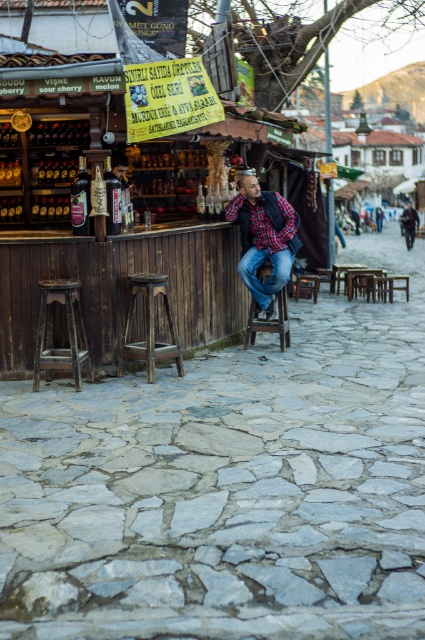
You are a customer at the bar and want to adjust your seating position to make more space for your bag. Which object should you move to create space between the wooden bar stool at center and the dark blue jeans at center?

You should move the wooden bar stool at center since it is positioned below the dark blue jeans at center, so moving it would create space between them.

You are a fashion designer observing a man in the scene. Which clothing item is located below the other between the plaid shirt at center and the dark blue jeans at center?

The plaid shirt at center is positioned under dark blue jeans at center, meaning the shirt is below the jeans.

You are a customer at the bar and want to order a drink. The bartender asks you to point to the sour cherry bottle on the counter. Which direction should you look relative to the plaid shirt at center and dark blue jeans at center?

The plaid shirt at center is closer to the viewer than the dark blue jeans at center. To locate the sour cherry bottle, look towards the plaid shirt at center direction since it is nearer and the bottles are on the counter in front of it.